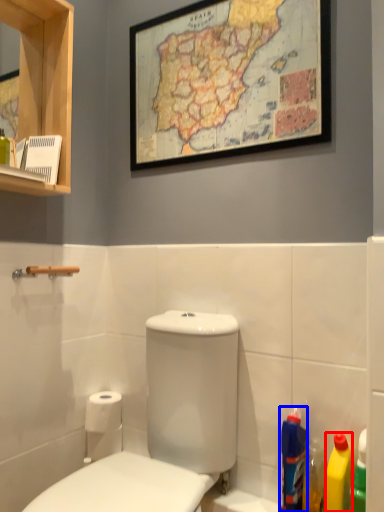
Question: Which of the following is the farthest to the observer, cleaning product (highlighted by a red box) or cleaning product (highlighted by a blue box)?

Choices:
 (A) cleaning product
 (B) cleaning product

Answer: (B)